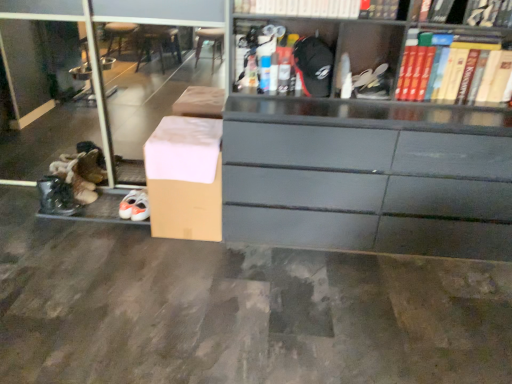
Question: Does hardcover book at upper right, the first book from the right, have a greater width compared to brown cardboard box at lower left?

Choices:
 (A) yes
 (B) no

Answer: (A)

Question: From a real-world perspective, is hardcover book at upper right, which is counted as the fourth book, starting from the left, on top of brown cardboard box at lower left?

Choices:
 (A) no
 (B) yes

Answer: (B)

Question: Would you say hardcover book at upper right, the first book from the right, is outside brown cardboard box at lower left?

Choices:
 (A) yes
 (B) no

Answer: (A)

Question: Is hardcover book at upper right, which is counted as the fourth book, starting from the left, behind brown cardboard box at lower left?

Choices:
 (A) no
 (B) yes

Answer: (A)

Question: Is hardcover book at upper right, which is counted as the fourth book, starting from the left, facing towards brown cardboard box at lower left?

Choices:
 (A) no
 (B) yes

Answer: (A)

Question: Is hardcover book at upper right, the first book from the right, positioned with its back to brown cardboard box at lower left?

Choices:
 (A) no
 (B) yes

Answer: (A)

Question: From a real-world perspective, is hardcover book at upper right, which is counted as the 2th book, starting from the right, below brown cardboard box at lower left?

Choices:
 (A) no
 (B) yes

Answer: (A)

Question: Can you confirm if hardcover book at upper right, marked as the third book in a left-to-right arrangement, is smaller than brown cardboard box at lower left?

Choices:
 (A) yes
 (B) no

Answer: (A)

Question: Does hardcover book at upper right, marked as the third book in a left-to-right arrangement, have a greater width compared to brown cardboard box at lower left?

Choices:
 (A) yes
 (B) no

Answer: (A)

Question: From the image's perspective, is hardcover book at upper right, marked as the third book in a left-to-right arrangement, on top of brown cardboard box at lower left?

Choices:
 (A) no
 (B) yes

Answer: (B)

Question: Is hardcover book at upper right, marked as the third book in a left-to-right arrangement, surrounding brown cardboard box at lower left?

Choices:
 (A) yes
 (B) no

Answer: (B)

Question: Does hardcover book at upper right, which is counted as the 2th book, starting from the right, appear on the right side of brown cardboard box at lower left?

Choices:
 (A) yes
 (B) no

Answer: (A)

Question: Does white matte shoe at upper center appear on the right side of hardcover book at upper right, which is counted as the fourth book, starting from the left?

Choices:
 (A) yes
 (B) no

Answer: (B)